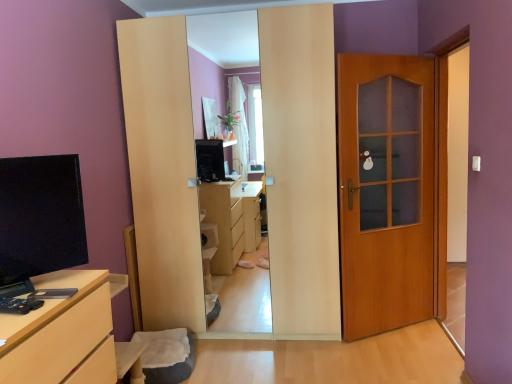
Find the location of a particular element. This screenshot has height=384, width=512. matte black tv at left is located at coordinates (40, 217).

In order to face matte black tv at left, should I rotate leftwards or rightwards?

Turn left by 26.964 degrees to look at matte black tv at left.

The image size is (512, 384). Describe the element at coordinates (385, 191) in the screenshot. I see `wooden door at right` at that location.

The height and width of the screenshot is (384, 512). What do you see at coordinates (56, 329) in the screenshot? I see `matte wood chest of drawers at lower left` at bounding box center [56, 329].

The width and height of the screenshot is (512, 384). What are the coordinates of `matte black tv at left` in the screenshot? It's located at (40, 217).

Who is taller, matte black tv at left or wooden door at right?

wooden door at right is taller.

Can you tell me how much matte black tv at left and wooden door at right differ in facing direction?

19.7 degrees separate the facing orientations of matte black tv at left and wooden door at right.

Which is closer, (19, 209) or (397, 141)?

Positioned in front is point (19, 209).

From a real-world perspective, is matte black tv at left under wooden door at right?

No, from a real-world perspective, matte black tv at left is not beneath wooden door at right.

I want to click on door behind the matte black tv at left, so click(x=385, y=191).

From the image's perspective, between wooden door at right and matte black tv at left, which one is located above?

wooden door at right is shown above in the image.

Would you consider wooden door at right to be distant from matte black tv at left?

Indeed, wooden door at right is not near matte black tv at left.

Which is in front, point (93, 314) or point (0, 260)?

The point (0, 260) is closer to the camera.

From a real-world perspective, is matte wood chest of drawers at lower left positioned above or below matte black tv at left?

matte wood chest of drawers at lower left is situated lower than matte black tv at left in the real world.

Between matte wood chest of drawers at lower left and matte black tv at left, which one appears on the right side from the viewer's perspective?

matte black tv at left.

What's the angular difference between matte wood chest of drawers at lower left and matte black tv at left's facing directions?

matte wood chest of drawers at lower left and matte black tv at left are facing 38.7 degrees away from each other.

Is wooden door at right oriented away from matte wood chest of drawers at lower left?

No, wooden door at right's orientation is not away from matte wood chest of drawers at lower left.

What's the angular difference between wooden door at right and matte wood chest of drawers at lower left's facing directions?

They differ by 58.4 degrees in their facing directions.

Can you confirm if wooden door at right is taller than matte wood chest of drawers at lower left?

Indeed, wooden door at right has a greater height compared to matte wood chest of drawers at lower left.

In the scene shown: Is matte wood chest of drawers at lower left inside wooden door at right?

Actually, matte wood chest of drawers at lower left is outside wooden door at right.

Could you tell me if matte black tv at left is turned towards matte wood chest of drawers at lower left?

No, matte black tv at left does not turn towards matte wood chest of drawers at lower left.

Based on the photo, can you tell me how much matte black tv at left and matte wood chest of drawers at lower left differ in facing direction?

They differ by 38.7 degrees in their facing directions.

Which object is positioned more to the left, matte black tv at left or matte wood chest of drawers at lower left?

Positioned to the left is matte wood chest of drawers at lower left.

From a real-world perspective, which object rests below the other?

matte wood chest of drawers at lower left, from a real-world perspective.

Considering the sizes of matte wood chest of drawers at lower left and wooden door at right in the image, is matte wood chest of drawers at lower left bigger or smaller than wooden door at right?

Clearly, matte wood chest of drawers at lower left is larger in size than wooden door at right.

From the image's perspective, is matte wood chest of drawers at lower left below wooden door at right?

Yes, from the image's perspective, matte wood chest of drawers at lower left is below wooden door at right.

Between matte wood chest of drawers at lower left and wooden door at right, which one appears on the left side from the viewer's perspective?

matte wood chest of drawers at lower left is more to the left.

Is matte wood chest of drawers at lower left in contact with wooden door at right?

matte wood chest of drawers at lower left and wooden door at right are not in contact.

Locate an element on the screen. The width and height of the screenshot is (512, 384). open lying on the left of wooden door at right is located at coordinates (40, 217).

You are a GUI agent. You are given a task and a screenshot of the screen. Output one action in this format:
    pyautogui.click(x=<x>, y=<y>)
    Task: Click on the door on the right side of matte black tv at left
    
    Given the screenshot: What is the action you would take?
    pyautogui.click(x=385, y=191)

Based on their spatial positions, is wooden door at right or matte wood chest of drawers at lower left further from matte black tv at left?

Among the two, wooden door at right is located further to matte black tv at left.

When comparing their distances from matte black tv at left, does matte wood chest of drawers at lower left or wooden door at right seem further?

wooden door at right is further to matte black tv at left.

Looking at the image, which one is located closer to matte wood chest of drawers at lower left, matte black tv at left or wooden door at right?

Based on the image, matte black tv at left appears to be nearer to matte wood chest of drawers at lower left.

From the image, which object appears to be farther from matte wood chest of drawers at lower left, wooden door at right or matte black tv at left?

wooden door at right is positioned further to the anchor matte wood chest of drawers at lower left.

Which object lies nearer to the anchor point wooden door at right, matte black tv at left or matte wood chest of drawers at lower left?

matte wood chest of drawers at lower left is closer to wooden door at right.

Which object lies nearer to the anchor point wooden door at right, matte wood chest of drawers at lower left or matte black tv at left?

matte wood chest of drawers at lower left.

Locate an element on the screen. The image size is (512, 384). open located between matte wood chest of drawers at lower left and wooden door at right in the left-right direction is located at coordinates (40, 217).